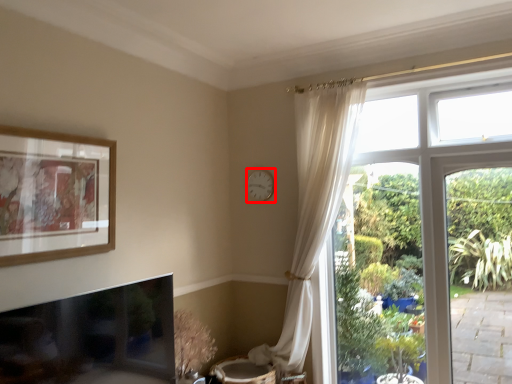
Question: From the image's perspective, where is clock (annotated by the red box) located relative to picture frame?

Choices:
 (A) above
 (B) below

Answer: (A)